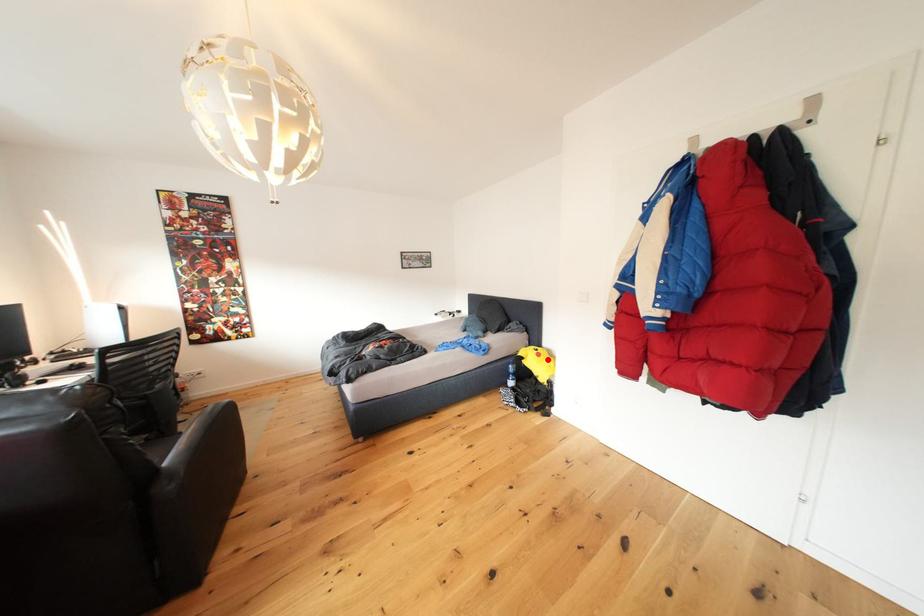
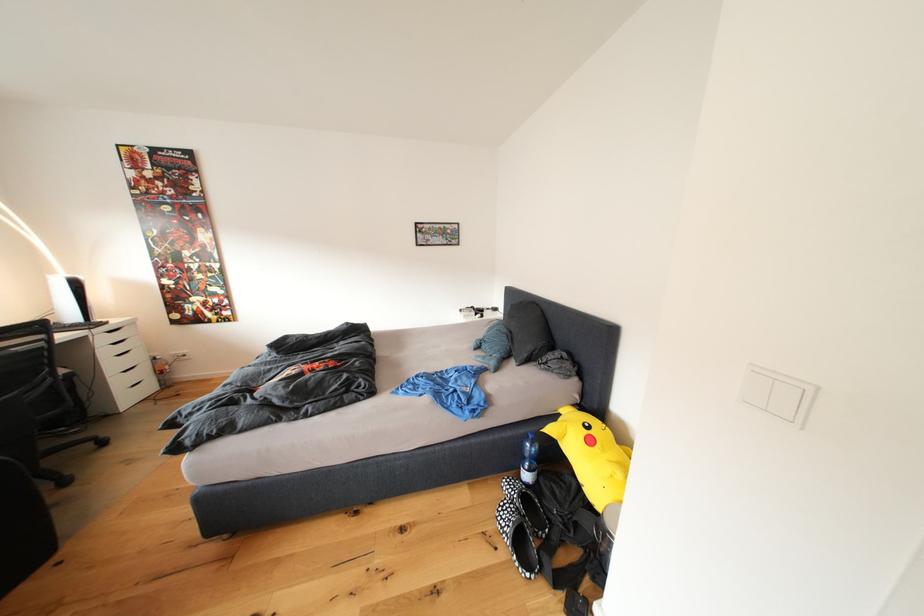
In the second image, find the point that corresponds to the highlighted location in the first image.

(600, 446)